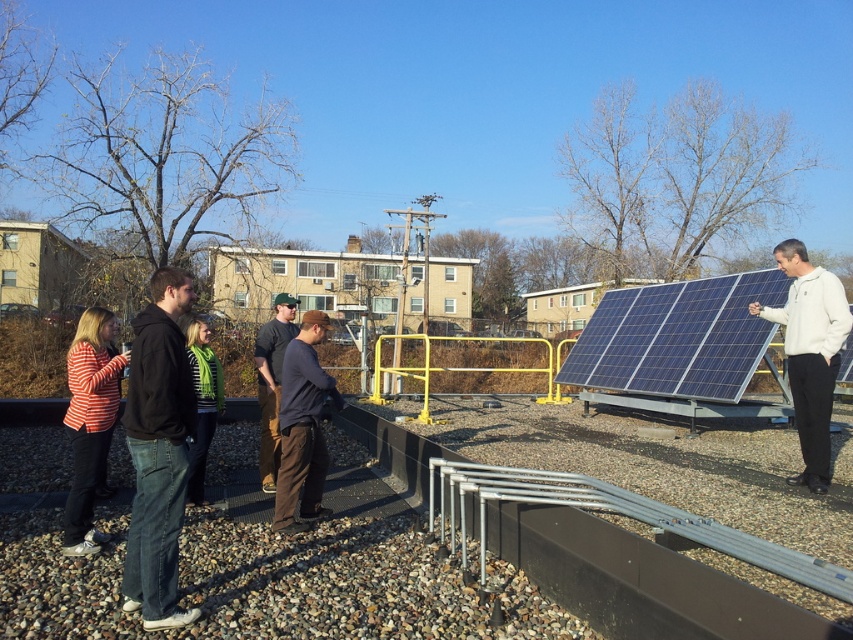
Does black hoodie at left appear on the right side of green knitted scarf at center?

Indeed, black hoodie at left is positioned on the right side of green knitted scarf at center.

Which is more to the left, black hoodie at left or green knitted scarf at center?

green knitted scarf at center

What do you see at coordinates (158, 451) in the screenshot?
I see `black hoodie at left` at bounding box center [158, 451].

Where is `black hoodie at left`? black hoodie at left is located at coordinates pos(158,451).

Does dark blue cotton shirt at center have a greater height compared to green knitted scarf at center?

Indeed, dark blue cotton shirt at center has a greater height compared to green knitted scarf at center.

Can you confirm if dark blue cotton shirt at center is positioned to the right of green knitted scarf at center?

Indeed, dark blue cotton shirt at center is positioned on the right side of green knitted scarf at center.

Between point (314, 468) and point (213, 429), which one is positioned in front?

Point (314, 468) is more forward.

Image resolution: width=853 pixels, height=640 pixels. Find the location of `dark blue cotton shirt at center`. dark blue cotton shirt at center is located at coordinates (302, 426).

Is dark blue shirt at center shorter than green knitted scarf at center?

In fact, dark blue shirt at center may be taller than green knitted scarf at center.

The width and height of the screenshot is (853, 640). Identify the location of dark blue shirt at center. (271, 384).

Describe the element at coordinates (271, 384) in the screenshot. The width and height of the screenshot is (853, 640). I see `dark blue shirt at center` at that location.

The height and width of the screenshot is (640, 853). I want to click on dark blue shirt at center, so click(271, 384).